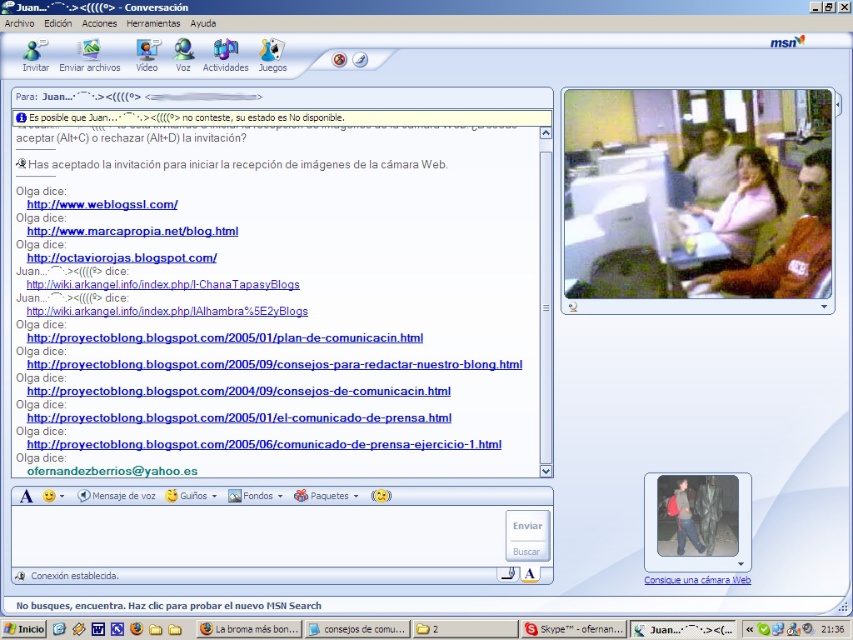
You are using MSN Messenger and see the camouflage pants at lower right and the white glossy text at bottom center. Which one is closer to you?

The camouflage pants at lower right is further to the viewer than white glossy text at bottom center, so the white glossy text at bottom center is closer to you.

You are a fashion designer analyzing the MSN chat interface. You see the pink fabric shirt at upper right and the white matte shirt at upper center in the video feed. Which shirt has a greater width in the video feed?

The pink fabric shirt at upper right has a greater width than the white matte shirt at upper center in the video feed.

In the chat window, which point is closer to the viewer between the point at [750,195] and the point at [686,172]?

Result: The point at [750,195] is closer to the viewer than the point at [686,172].